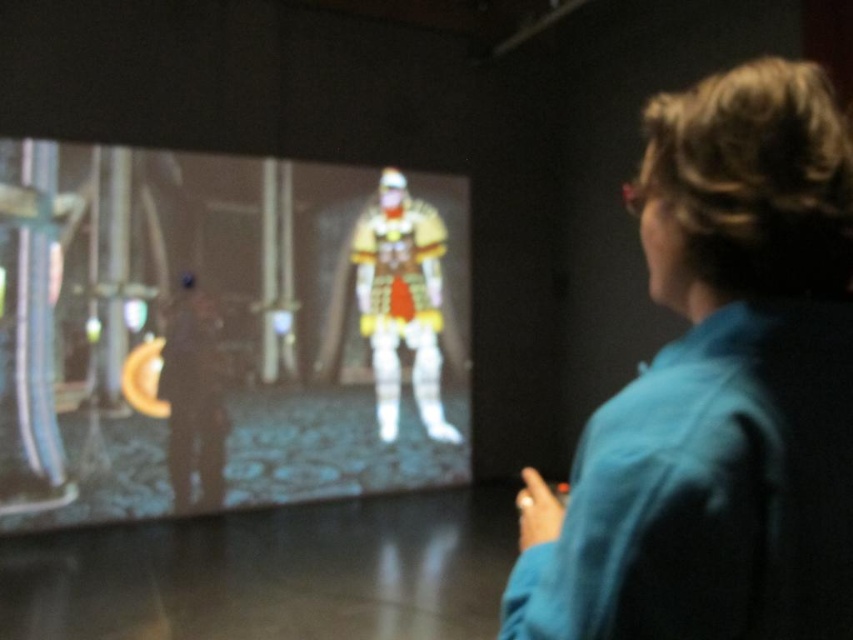
Question: Which of the following is the closest to the observer?

Choices:
 (A) (119, 262)
 (B) (741, 92)
 (C) (387, 250)

Answer: (B)

Question: From the image, what is the correct spatial relationship of matte plastic figure at center in relation to blue fabric at upper right?

Choices:
 (A) below
 (B) above

Answer: (A)

Question: Can you confirm if blue fabric at upper right is positioned above white glossy armor at center?

Choices:
 (A) no
 (B) yes

Answer: (A)

Question: Which point is closer to the camera?

Choices:
 (A) matte plastic figure at center
 (B) white glossy armor at center
 (C) blue fabric at upper right

Answer: (C)

Question: Can you confirm if matte plastic figure at center is smaller than blue fabric at upper right?

Choices:
 (A) no
 (B) yes

Answer: (A)

Question: Which point is farther to the camera?

Choices:
 (A) (302, 342)
 (B) (769, 436)
 (C) (372, 372)

Answer: (C)